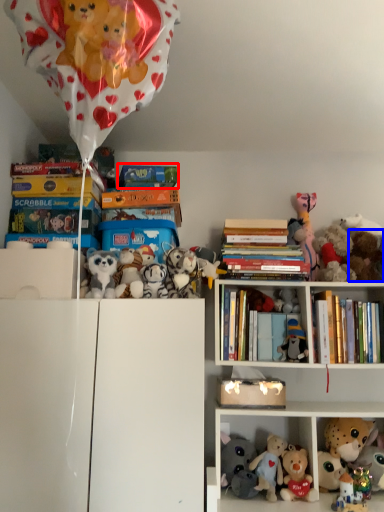
Question: Which object appears closest to the camera in this image, book (highlighted by a red box) or toy (highlighted by a blue box)?

Choices:
 (A) book
 (B) toy

Answer: (B)